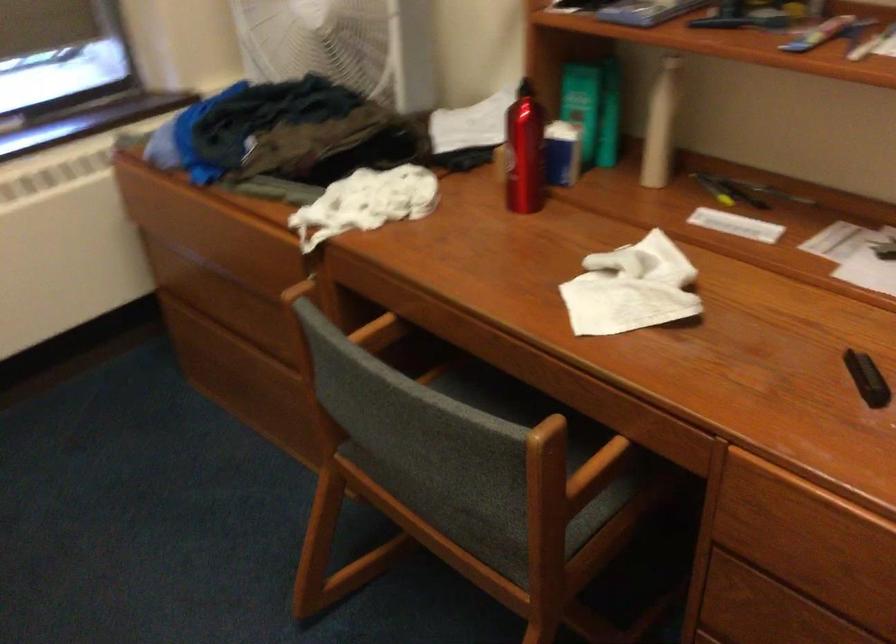
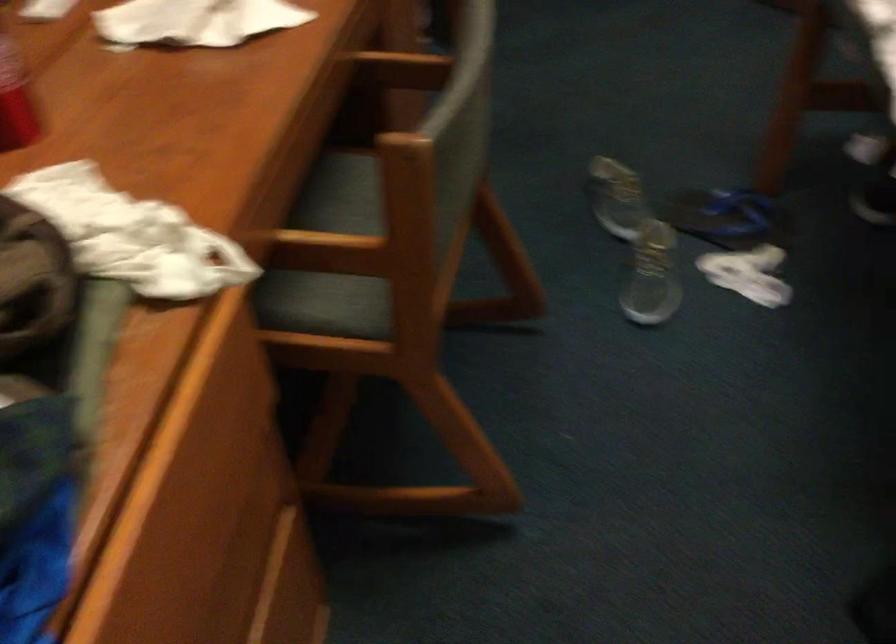
Question: I am providing you with two images of the same scene from different viewpoints. After the viewpoint changes to image2, which objects are now occluded?

Choices:
 (A) horizontal door handle
 (B) chair sitting surface
 (C) blue flip-flop
 (D) gray sneaker

Answer: (B)